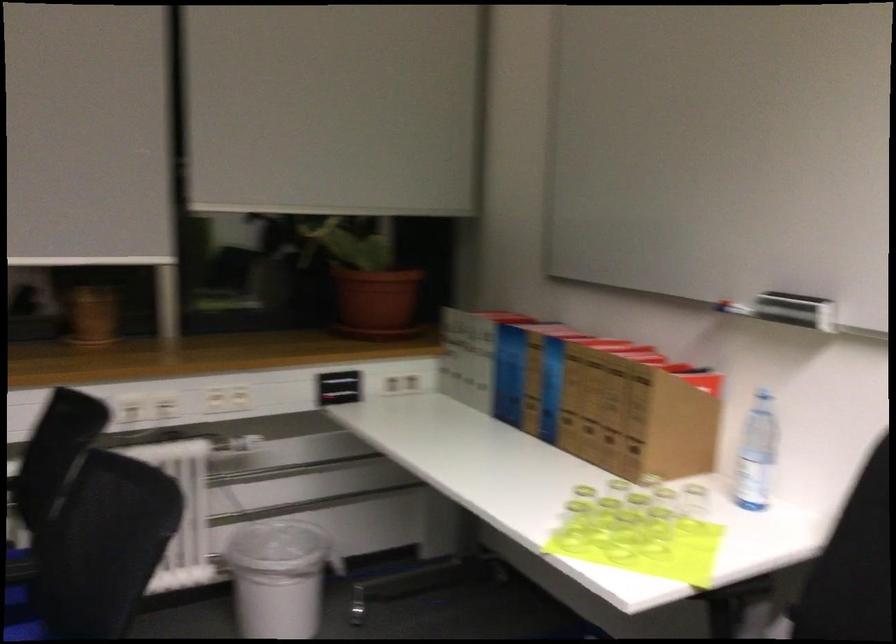
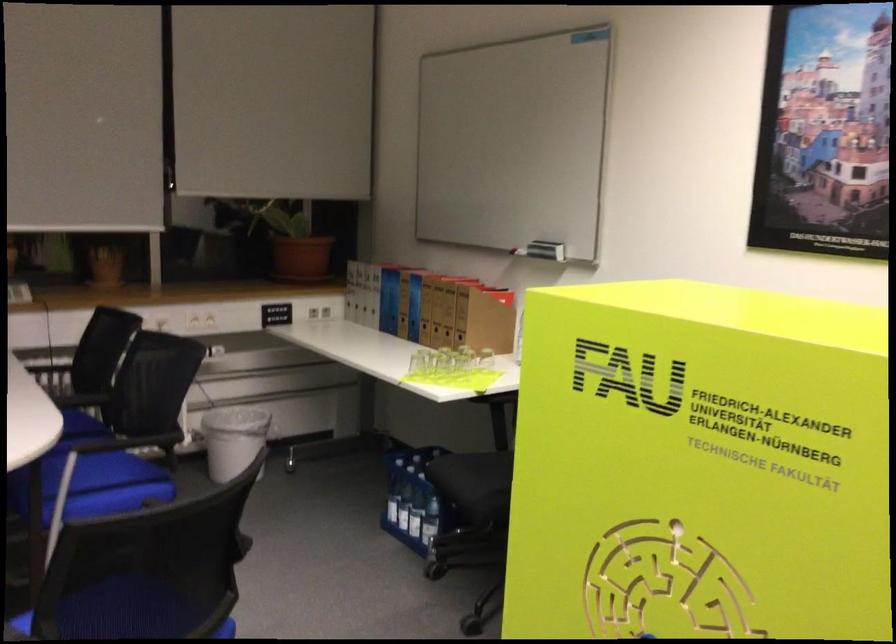
In the second image, find the point that corresponds to point (489, 401) in the first image.

(382, 321)